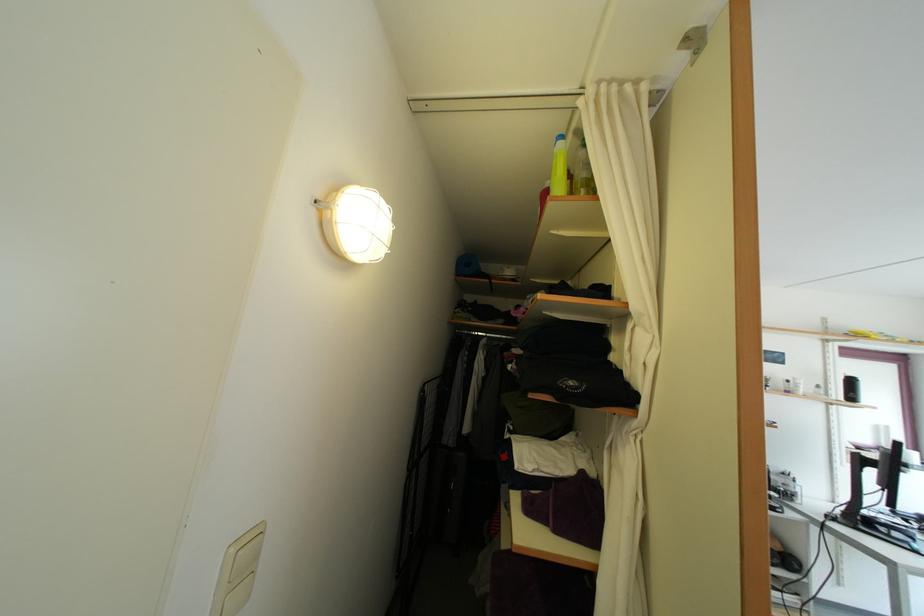
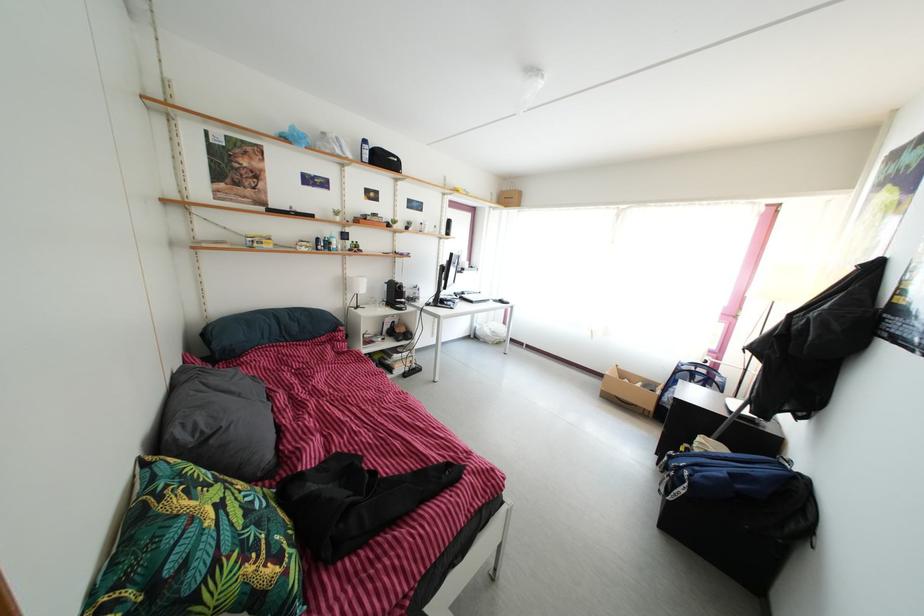
First-person continuous shooting, in which direction is the camera rotating?

The rotation direction of the camera is right-down.